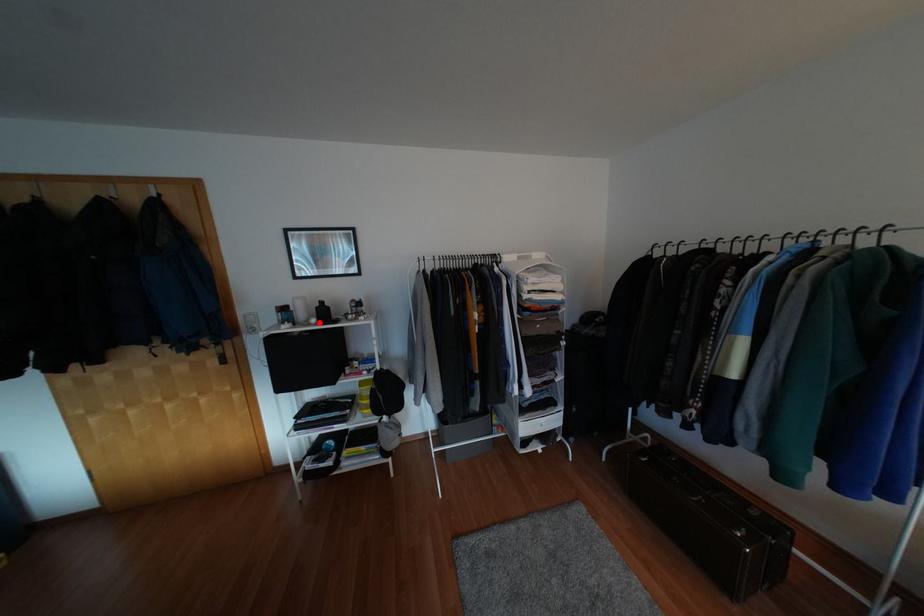
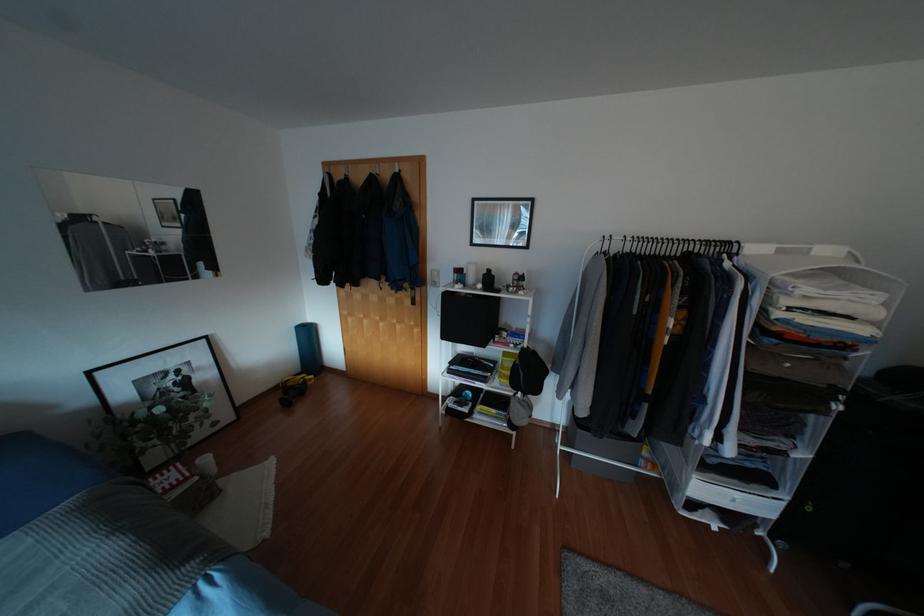
In the second image, find the point that corresponds to the highlighted location in the first image.

(483, 289)